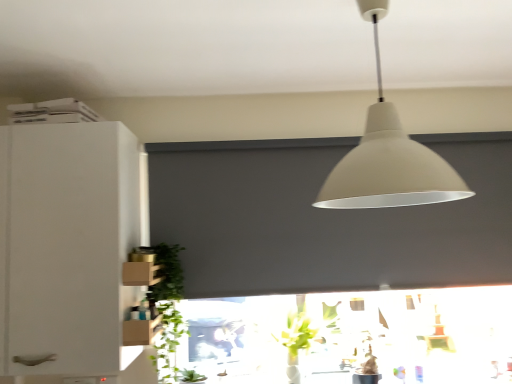
Question: From a real-world perspective, is white matte cabinet at left positioned above or below green leafy plant at lower left?

Choices:
 (A) above
 (B) below

Answer: (A)

Question: Is point (25, 256) closer or farther from the camera than point (169, 375)?

Choices:
 (A) farther
 (B) closer

Answer: (B)

Question: Estimate the real-world distances between objects in this image. Which object is closer to the green leafy plant at lower left?

Choices:
 (A) matte gray window screen at center
 (B) matte white lampshade at upper center
 (C) white matte cabinet at left

Answer: (C)

Question: Considering the real-world distances, which object is farthest from the white matte cabinet at left?

Choices:
 (A) matte white lampshade at upper center
 (B) green leafy plant at lower left
 (C) matte gray window screen at center

Answer: (A)